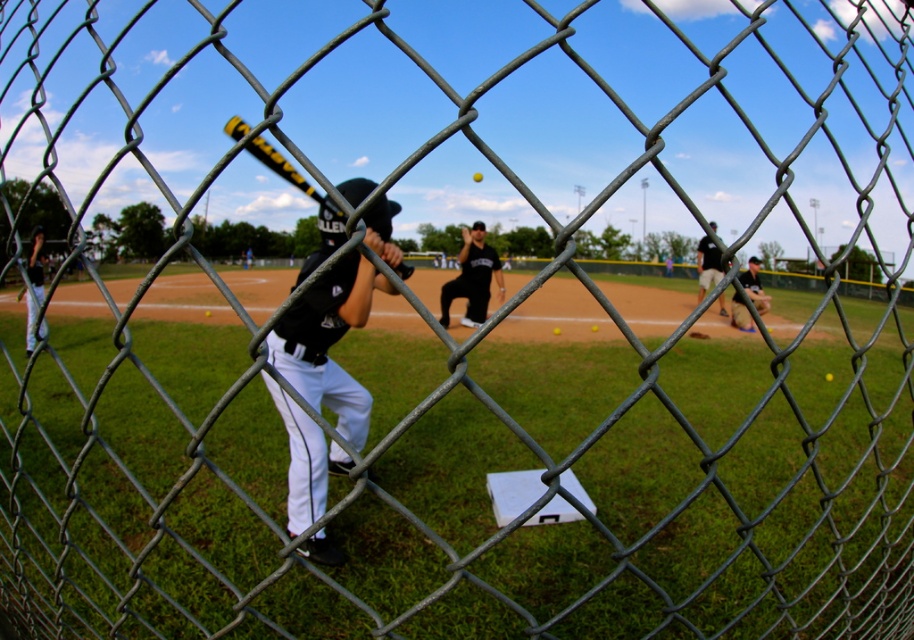
Question: Considering the real-world distances, which object is farthest from the dark gray uniform at center?

Choices:
 (A) black matte uniform at center
 (B) yellow matte baseball at center
 (C) black uniform at lower right
 (D) yellow/black textured bat at center

Answer: (B)

Question: Can you confirm if matte black baseball bat at left is wider than black uniform at lower right?

Choices:
 (A) no
 (B) yes

Answer: (B)

Question: Can you confirm if yellow/black textured bat at center is positioned to the right of matte black baseball bat at left?

Choices:
 (A) no
 (B) yes

Answer: (B)

Question: Which of the following is the closest to the observer?

Choices:
 (A) matte black baseball bat at left
 (B) black matte uniform at center
 (C) yellow matte baseball at center

Answer: (B)

Question: Which point is farther from the camera taking this photo?

Choices:
 (A) (477, 176)
 (B) (323, 250)

Answer: (A)

Question: Can you confirm if black uniform at lower right is positioned below dark gray uniform at center?

Choices:
 (A) yes
 (B) no

Answer: (A)